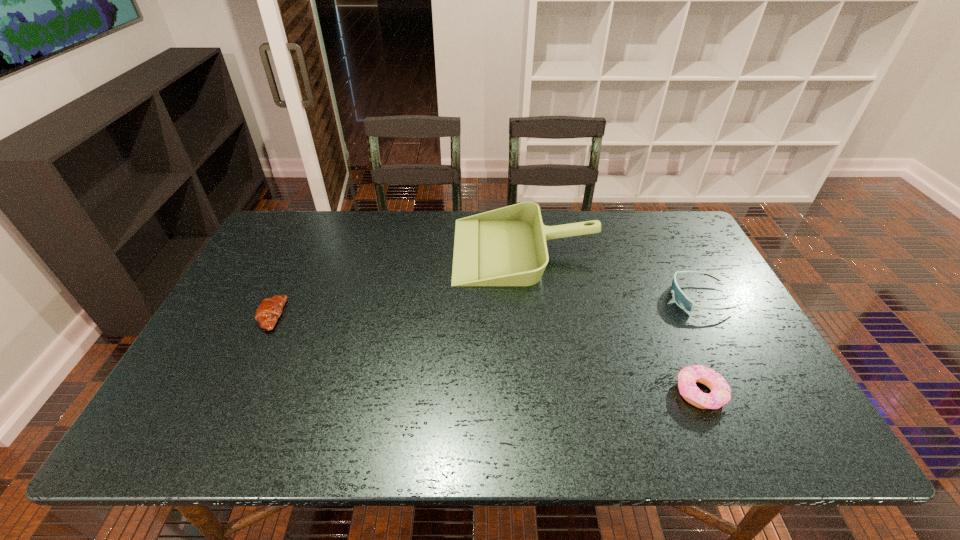
The image size is (960, 540). In order to click on free space at the near edge of the desktop in this screenshot , I will do `click(391, 431)`.

In the image, there is a desktop. Identify the location of vacant space at the right edge. (699, 255).

In order to click on vacant region at the far left corner of the desktop in this screenshot , I will do `click(324, 218)`.

The width and height of the screenshot is (960, 540). In the image, there is a desktop. Find the location of `vacant space at the far right corner`. vacant space at the far right corner is located at coordinates (636, 212).

Identify the location of free space between the goggles and the dustpan. (612, 274).

The height and width of the screenshot is (540, 960). What are the coordinates of `blank region between the dustpan and the crescent roll` in the screenshot? It's located at (398, 283).

Identify the location of vacant area that lies between the tallest object and the doughnut. pyautogui.click(x=612, y=322).

Where is `free space between the dustpan and the nearest object`? The image size is (960, 540). free space between the dustpan and the nearest object is located at coordinates (612, 322).

Identify the location of empty space between the doughnut and the dustpan. (612, 322).

The image size is (960, 540). What are the coordinates of `empty space between the dustpan and the second tallest object` in the screenshot? It's located at (612, 274).